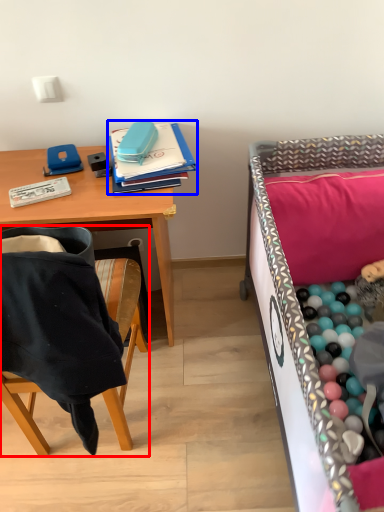
Question: Which object is closer to the camera taking this photo, chair (highlighted by a red box) or notebook (highlighted by a blue box)?

Choices:
 (A) chair
 (B) notebook

Answer: (A)